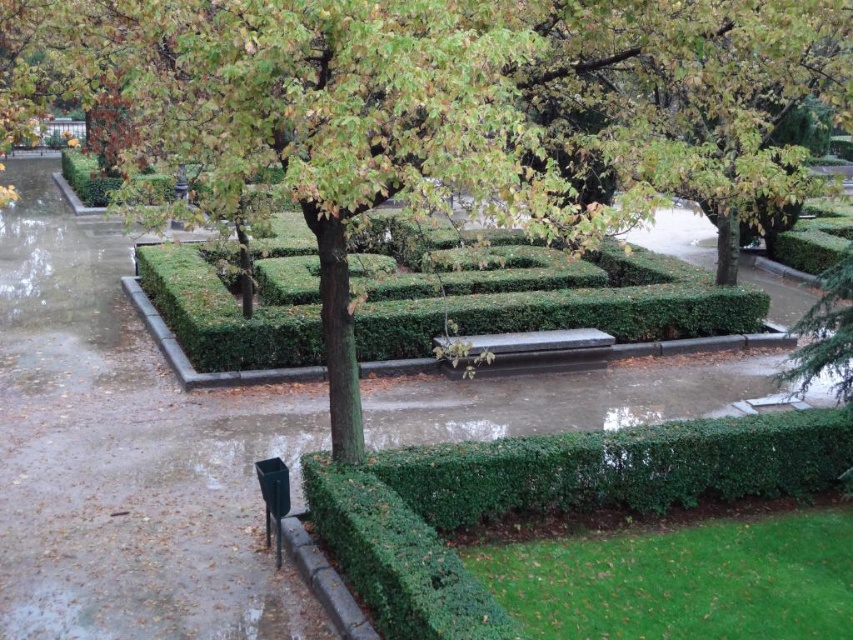
You are a gardener planning to place a new decorative statue that is 2 meters wide. You see the green leafy hedge at lower right and the smooth dark brown bench at center. Which object should you avoid placing the statue next to to ensure there is enough space?

You should avoid placing the statue next to the green leafy hedge at lower right because it has a smaller size compared to the smooth dark brown bench at center, leaving less space around it for the statue.

You are a gardener who needs to water both the green leafy tree at center and the green leafy hedge at center. Your watering can has a range of 3 meters. Can you water both without moving the can?

The distance between the green leafy tree at center and the green leafy hedge at center is 3.24 meters. Since the watering can has a range of 3 meters, you cannot reach both without moving the can.

You are standing in the garden and want to take a photo of the green leafy tree at center. If you are positioned at the origin point of the garden coordinate system, which direction should you move to face the tree?

The green leafy tree at center is located at coordinate point 0.169 on the x axis and 0.524 on the y axis. Since the origin is at the bottom left corner, moving towards positive x and y directions would face the tree.